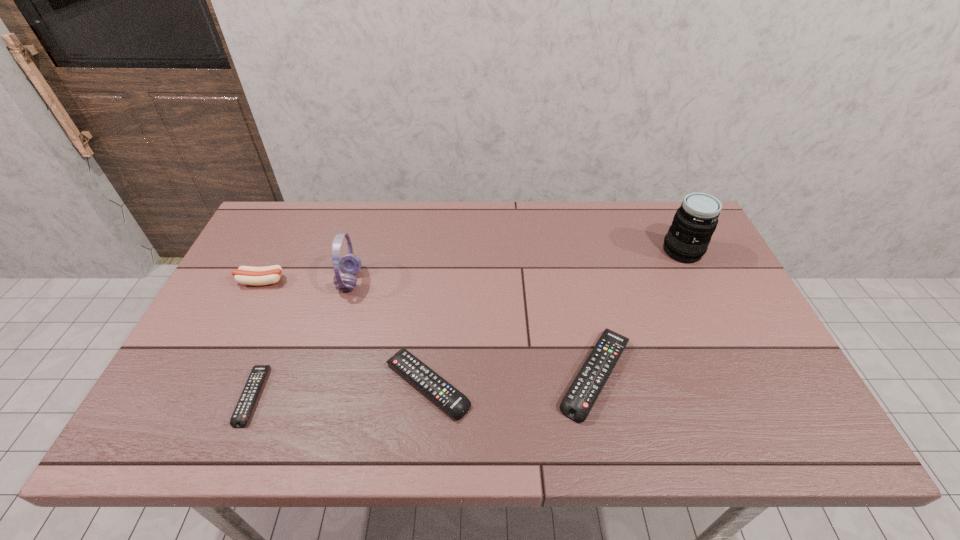
In the image, there is a desktop. In order to click on free space at the far edge in this screenshot , I will do `click(372, 227)`.

Locate an element on the screen. The height and width of the screenshot is (540, 960). blank space at the near edge of the desktop is located at coordinates (681, 382).

I want to click on vacant space at the right edge of the desktop, so click(x=732, y=334).

Identify the location of vacant space at the far left corner of the desktop. This screenshot has width=960, height=540. (259, 246).

The height and width of the screenshot is (540, 960). Find the location of `free space at the near left corner of the desktop`. free space at the near left corner of the desktop is located at coordinates (225, 402).

This screenshot has width=960, height=540. Identify the location of vacant region at the far right corner of the desktop. (668, 212).

Find the location of `free space at the near right corner of the desktop`. free space at the near right corner of the desktop is located at coordinates (778, 375).

Identify the location of vacant space in between the second shortest object and the sausage. (345, 333).

This screenshot has width=960, height=540. Find the location of `vacant area between the leftmost object and the second tallest object`. vacant area between the leftmost object and the second tallest object is located at coordinates (305, 281).

Locate an element on the screen. The height and width of the screenshot is (540, 960). free space between the fifth object from left to right and the second tallest remote control is located at coordinates (512, 380).